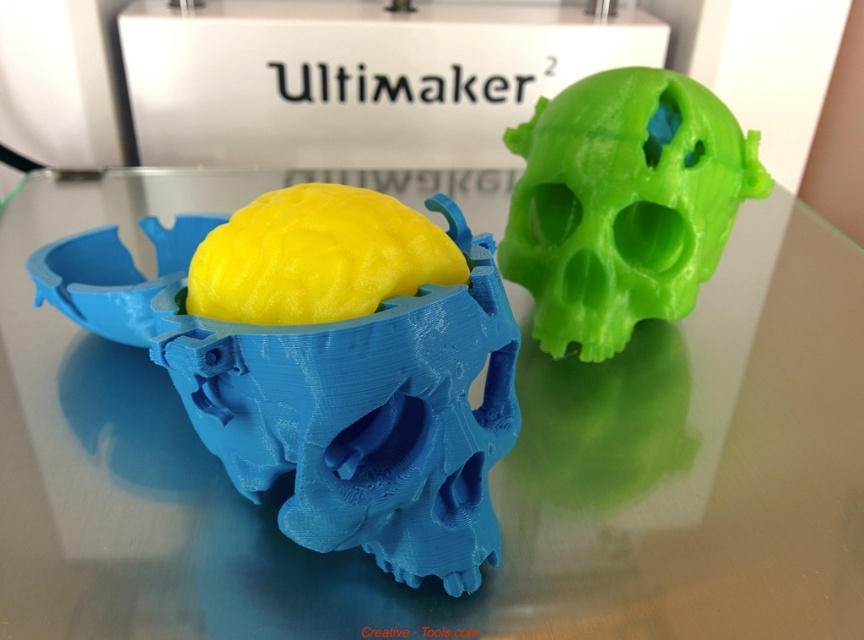
Is point (423, 195) farther from camera compared to point (723, 129)?

Yes, it is.

Does point (178, 561) come in front of point (712, 211)?

Yes, it is in front of point (712, 211).

Is point (513, 563) less distant than point (540, 300)?

Yes, point (513, 563) is closer to viewer.

The width and height of the screenshot is (864, 640). In order to click on transparent glass skull at center in this screenshot , I will do `click(490, 474)`.